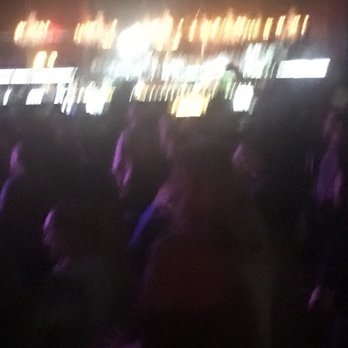
Find the location of a particular element. This screenshot has height=348, width=348. big light is located at coordinates (126, 57).